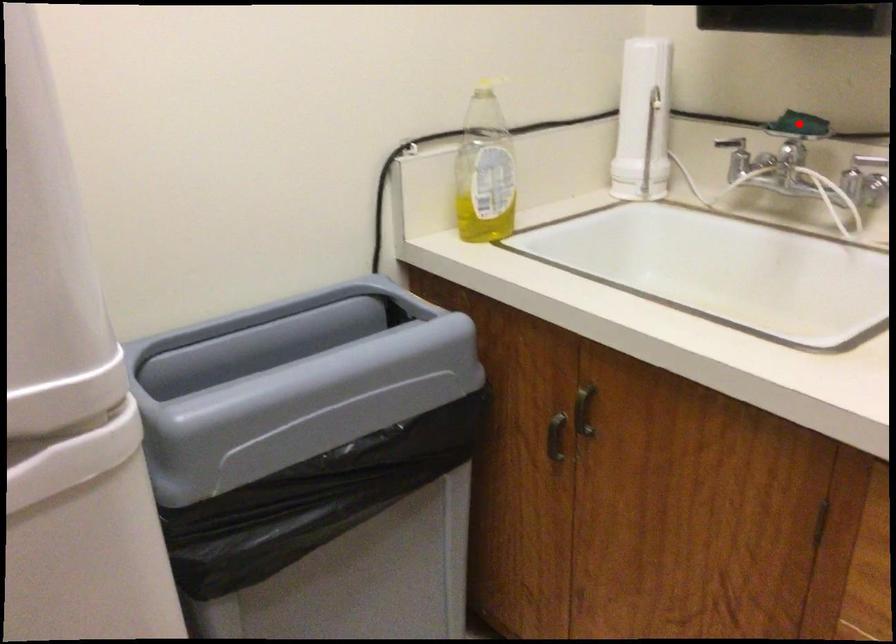
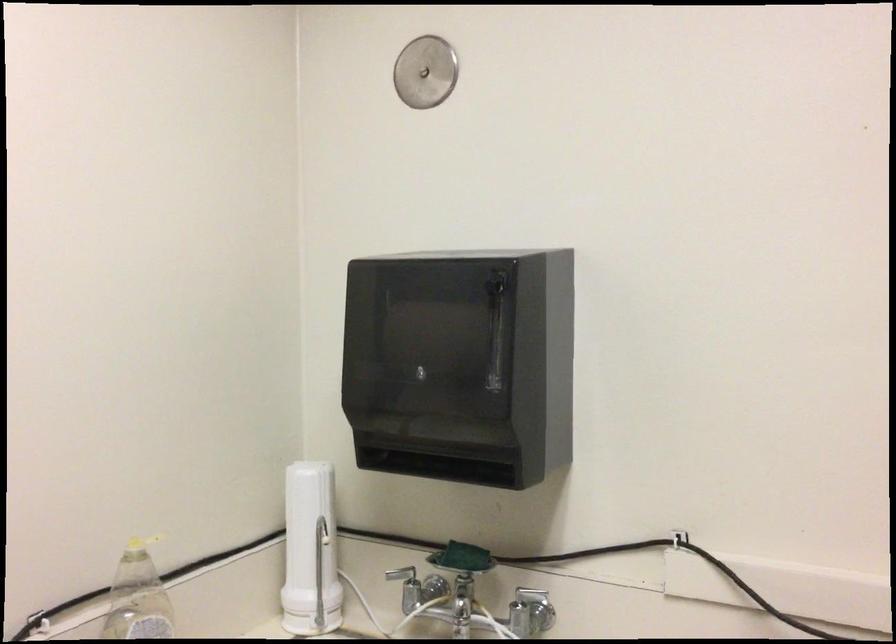
Locate, in the second image, the point that corresponds to the highlighted location in the first image.

(462, 558)